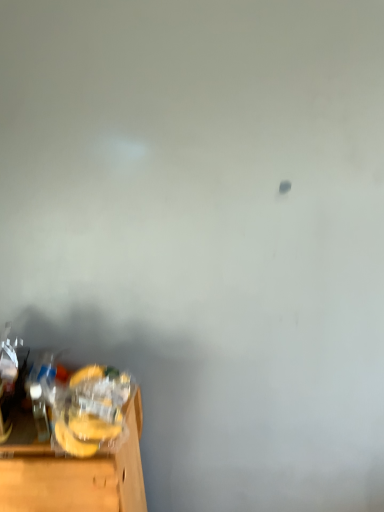
Locate an element on the screen. The height and width of the screenshot is (512, 384). yellow matte bananas at lower left is located at coordinates (71, 471).

Image resolution: width=384 pixels, height=512 pixels. What do you see at coordinates (71, 471) in the screenshot?
I see `yellow matte bananas at lower left` at bounding box center [71, 471].

This screenshot has height=512, width=384. What are the coordinates of `yellow matte bananas at lower left` in the screenshot? It's located at point(71,471).